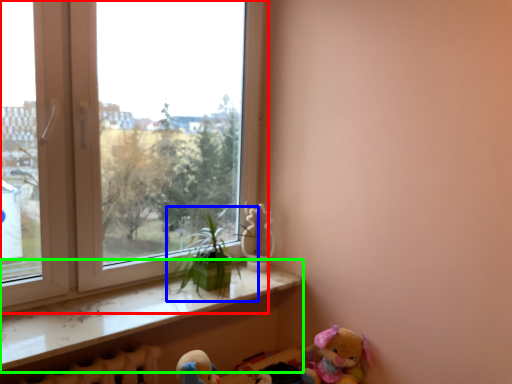
Question: Which object is the farthest from window (highlighted by a red box)? Choose among these: houseplant (highlighted by a blue box) or window sill (highlighted by a green box).

Choices:
 (A) houseplant
 (B) window sill

Answer: (A)